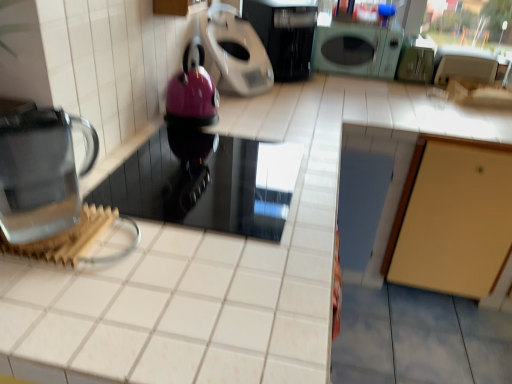
Locate an element on the screen. vacant space to the right of glossy plastic kettle at upper center, the second appliance when ordered from bottom to top is located at coordinates 244,124.